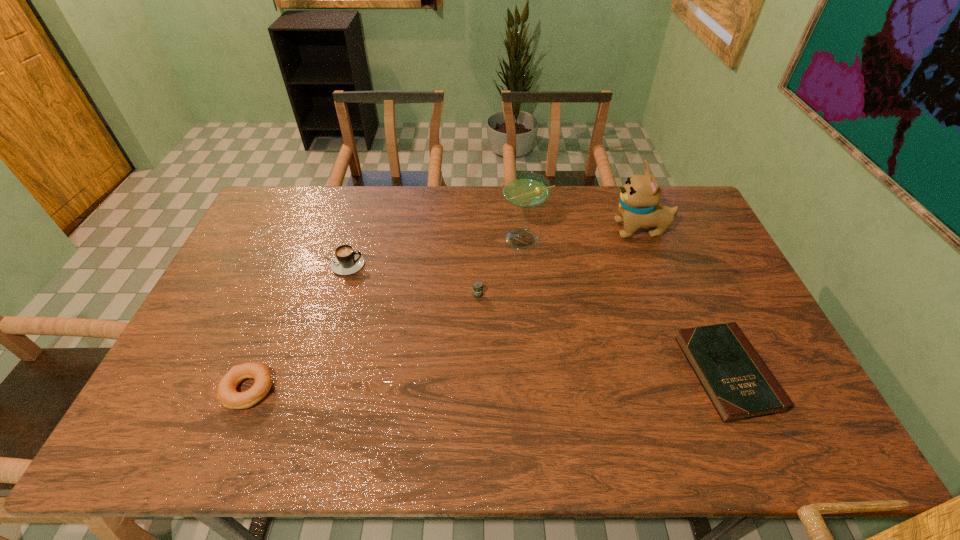
Where is `puppy`? The width and height of the screenshot is (960, 540). puppy is located at coordinates (639, 206).

Where is `the third object from right to left`? the third object from right to left is located at coordinates (526, 190).

You are a GUI agent. You are given a task and a screenshot of the screen. Output one action in this format:
    pyautogui.click(x=<x>, y=<y>)
    Task: Click on the cappuccino
    The width and height of the screenshot is (960, 540).
    Given the screenshot: What is the action you would take?
    pyautogui.click(x=346, y=262)

This screenshot has width=960, height=540. I want to click on beer can, so click(x=477, y=285).

I want to click on the fourth object from right to left, so click(x=477, y=285).

This screenshot has width=960, height=540. Identify the location of bagel. (226, 393).

Find the location of a particular element. The width and height of the screenshot is (960, 540). Bible is located at coordinates (740, 386).

Image resolution: width=960 pixels, height=540 pixels. I want to click on vacant space situated on the face of the puppy, so click(x=550, y=230).

At what (x,y) coordinates should I click in order to perform the action: click on vacant space located 0.350m on the face of the puppy. Please return your answer as a coordinate pair (x, y). This screenshot has height=540, width=960. Looking at the image, I should click on (509, 230).

The image size is (960, 540). Identify the location of vacant space situated 0.290m on the face of the puppy. (527, 230).